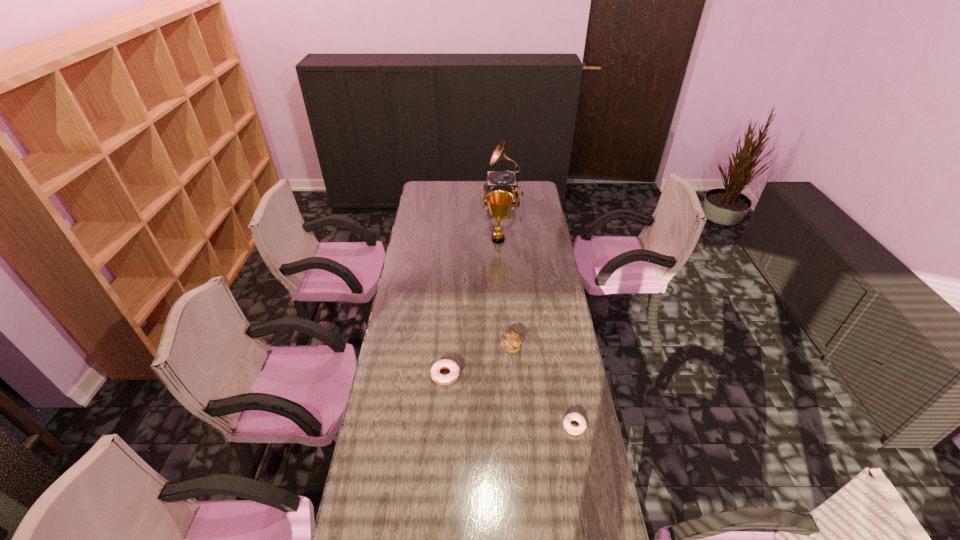
Where is `vacant point at the left edge`? vacant point at the left edge is located at coordinates (396, 309).

In the image, there is a desktop. At what (x,y) coordinates should I click in order to perform the action: click on blank space at the right edge. Please return your answer as a coordinate pair (x, y). Image resolution: width=960 pixels, height=540 pixels. Looking at the image, I should click on (579, 389).

At what (x,y) coordinates should I click in order to perform the action: click on free location at the far left corner. Please return your answer as a coordinate pair (x, y). This screenshot has width=960, height=540. Looking at the image, I should click on (425, 187).

This screenshot has height=540, width=960. In order to click on free space between the nearest object and the fourth nearest object in this screenshot , I will do `click(536, 333)`.

I want to click on vacant area that lies between the record player and the muffin, so [507, 272].

Image resolution: width=960 pixels, height=540 pixels. Find the location of `free space between the farthest object and the nearer doughnut`. free space between the farthest object and the nearer doughnut is located at coordinates (539, 312).

At what (x,y) coordinates should I click in order to perform the action: click on vacant point located between the second farthest object and the taller doughnut. Please return your answer as a coordinate pair (x, y). Image resolution: width=960 pixels, height=540 pixels. Looking at the image, I should click on (471, 307).

Locate an element on the screen. free spot between the third farthest object and the record player is located at coordinates (507, 272).

The height and width of the screenshot is (540, 960). What are the coordinates of `empty location between the second farthest object and the muffin` in the screenshot? It's located at (504, 293).

Locate an element on the screen. vacant space that's between the record player and the third shortest object is located at coordinates (507, 272).